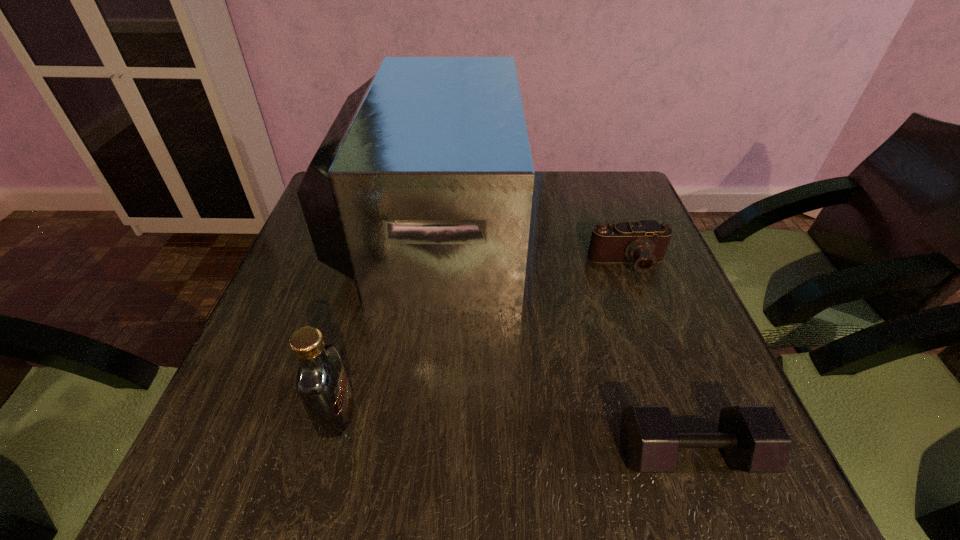
Find the location of a particular element. Image resolution: width=960 pixels, height=540 pixels. free space that satisfies the following two spatial constraints: 1. on the front-facing side of the camera; 2. on the front-facing side of the vodka is located at coordinates (684, 414).